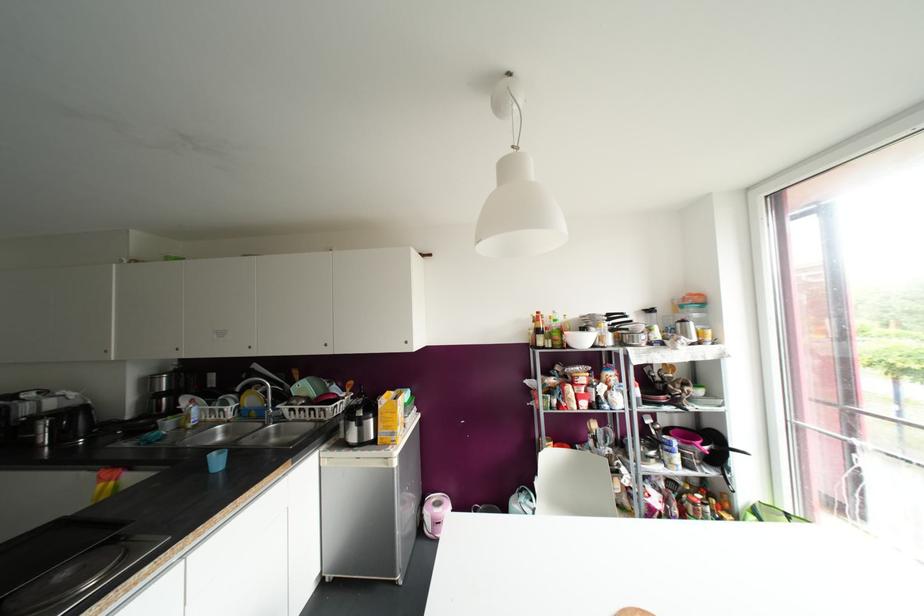
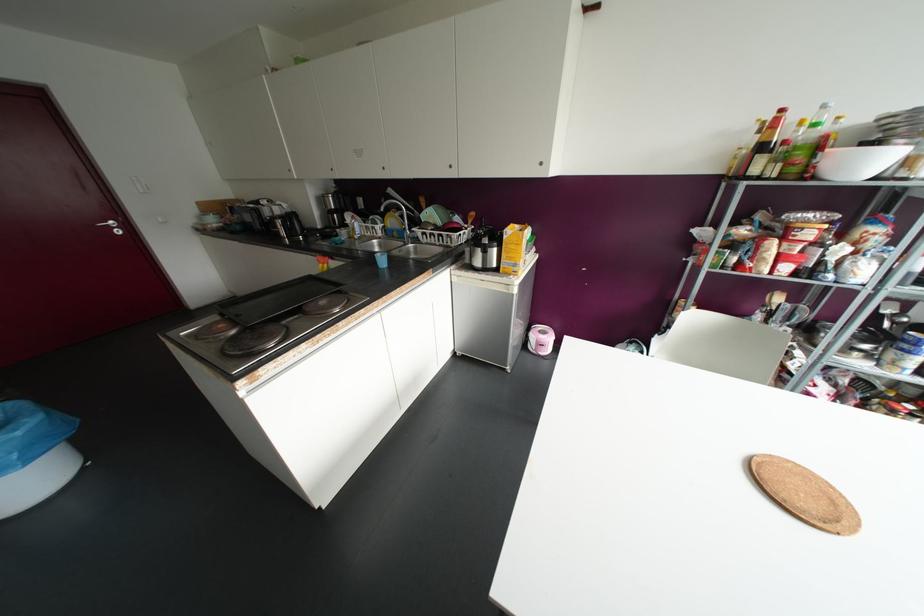
Where in the second image is the point corresponding to [553,312] from the first image?

(823, 106)